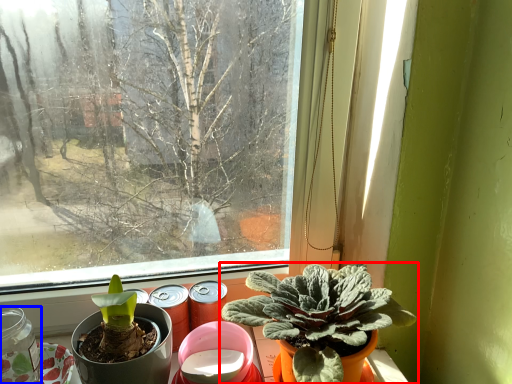
Question: Among these objects, which one is nearest to the camera, houseplant (highlighted by a red box) or glass jar (highlighted by a blue box)?

Choices:
 (A) houseplant
 (B) glass jar

Answer: (A)